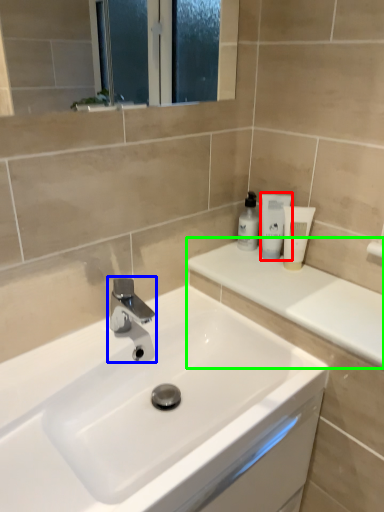
Question: Which object is the closest to the toiletry (highlighted by a red box)? Choose among these: tap (highlighted by a blue box) or counter top (highlighted by a green box).

Choices:
 (A) tap
 (B) counter top

Answer: (B)